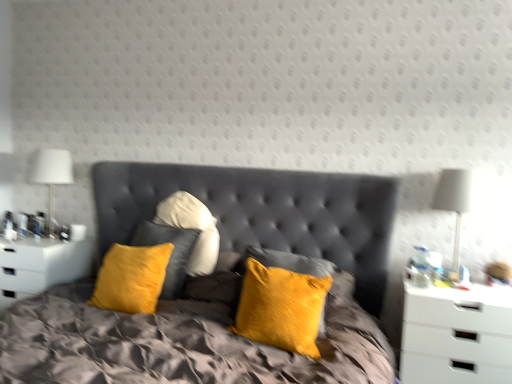
Question: Considering the positions of velvet yellow pillow at center and white fabric lampshade at left, marked as the first bedside lamp in a left-to-right arrangement, in the image, is velvet yellow pillow at center taller or shorter than white fabric lampshade at left, marked as the first bedside lamp in a left-to-right arrangement,?

Choices:
 (A) tall
 (B) short

Answer: (B)

Question: Based on their positions, is velvet yellow pillow at center located to the left or right of white fabric lampshade at left, positioned as the second bedside lamp in right-to-left order?

Choices:
 (A) right
 (B) left

Answer: (A)

Question: Considering the real-world distances, which object is closest to the white fabric lampshade at left, which ranks as the first bedside lamp in back-to-front order?

Choices:
 (A) velvet yellow pillows at center
 (B) white matte nightstand at right, acting as the 1th nightstand starting from the front
 (C) white fabric lampshade at right, positioned as the first bedside lamp in right-to-left order
 (D) white glossy nightstand at left, the 1th nightstand viewed from the left
 (E) velvet yellow pillow at center

Answer: (D)

Question: Which of these objects is positioned farthest from the white fabric lampshade at left, the second bedside lamp viewed from the front?

Choices:
 (A) velvet yellow pillows at center
 (B) velvet yellow pillow at center
 (C) white fabric lampshade at right, placed as the second bedside lamp when sorted from back to front
 (D) white glossy nightstand at left, marked as the first nightstand in a back-to-front arrangement
 (E) white matte nightstand at right, the second nightstand when ordered from back to front

Answer: (E)